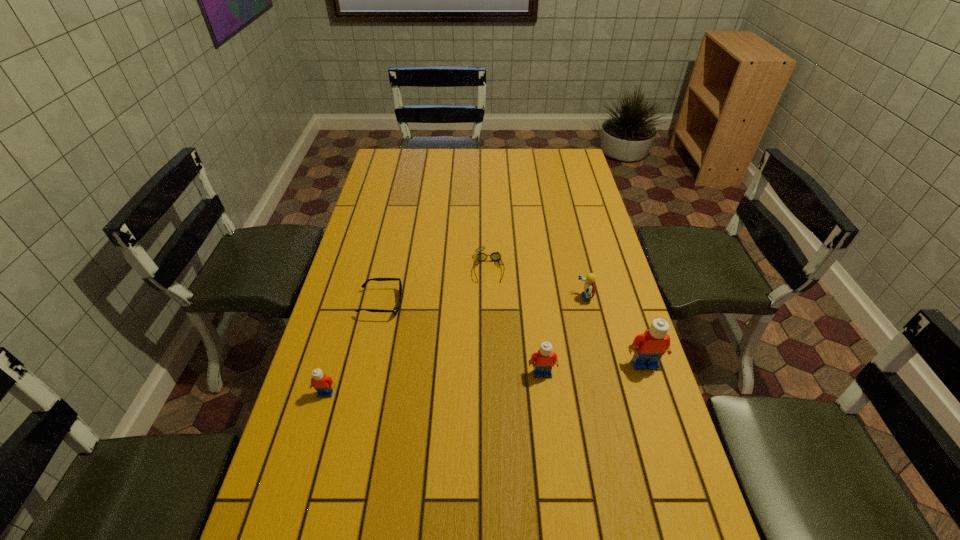
You are a GUI agent. You are given a task and a screenshot of the screen. Output one action in this format:
    pyautogui.click(x=<x>, y=<y>)
    Task: Click on the sunglasses that is positioned at the left edge
    The height and width of the screenshot is (540, 960).
    Given the screenshot: What is the action you would take?
    pyautogui.click(x=396, y=309)

Image resolution: width=960 pixels, height=540 pixels. Find the location of `blank area at the far edge`. blank area at the far edge is located at coordinates (526, 167).

Where is `vacant point at the near edge`? This screenshot has width=960, height=540. vacant point at the near edge is located at coordinates (515, 524).

This screenshot has width=960, height=540. In order to click on free space at the left edge in this screenshot , I will do `click(340, 409)`.

In the image, there is a desktop. What are the coordinates of `vacant area at the right edge` in the screenshot? It's located at 633,481.

At what (x,y) coordinates should I click in order to perform the action: click on vacant space at the far left corner of the desktop. Please return your answer as a coordinate pair (x, y). Looking at the image, I should click on (406, 151).

Where is `free space at the near left corner of the desktop`? free space at the near left corner of the desktop is located at coordinates (328, 513).

Locate an element on the screen. vacant region between the tallest object and the nearest object is located at coordinates (485, 379).

Find the location of a particular element. This screenshot has width=960, height=540. free space between the nearest object and the third shortest Lego is located at coordinates (434, 383).

Find the location of a particular element. The image size is (960, 540). free space between the sunglasses and the second tallest object is located at coordinates (462, 339).